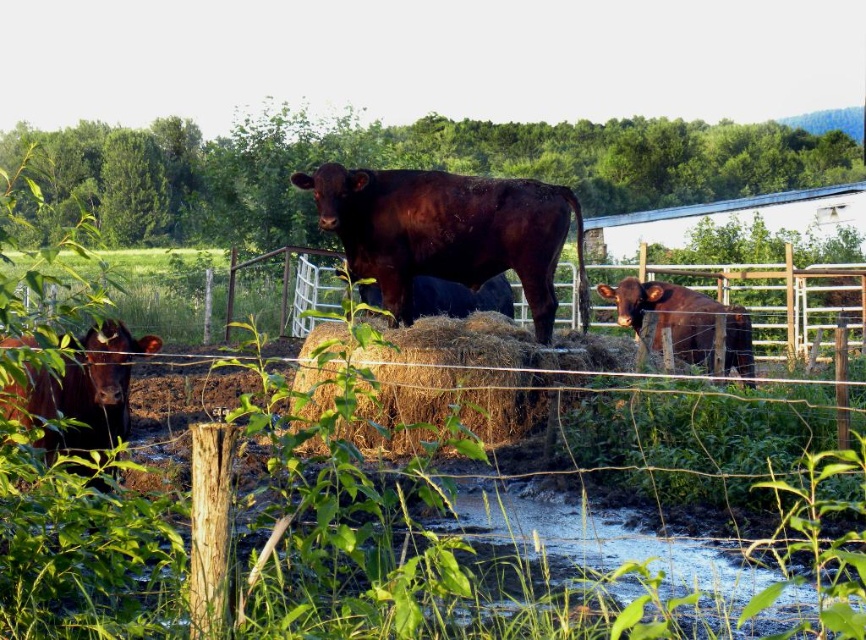
You are a farmer checking the cattle in the fenced area. You notice the shiny dark brown bull at center and the brown hay at center. Which object is closer to you according to the scene?

The brown hay at center is in front of the shiny dark brown bull at center, so the brown hay at center is closer to you.

You are a farmer who needs to separate the shiny dark brown bull at center and the shiny brown cow at center using a fence. Based on their positions in the image, which direction should you place the fence to separate them?

The shiny dark brown bull at center is positioned on the left side of the shiny brown cow at center, so placing the fence to the left of the shiny brown cow at center would separate them.